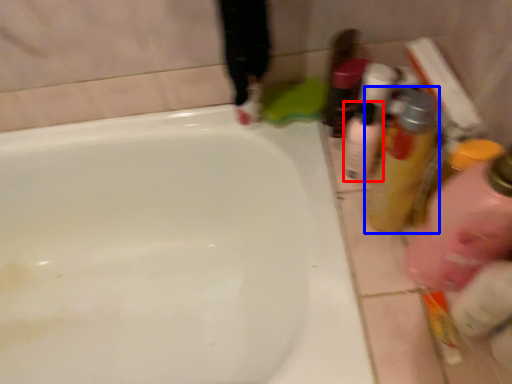
Question: Which object is further to the camera taking this photo, mouthwash (highlighted by a red box) or mouthwash (highlighted by a blue box)?

Choices:
 (A) mouthwash
 (B) mouthwash

Answer: (A)